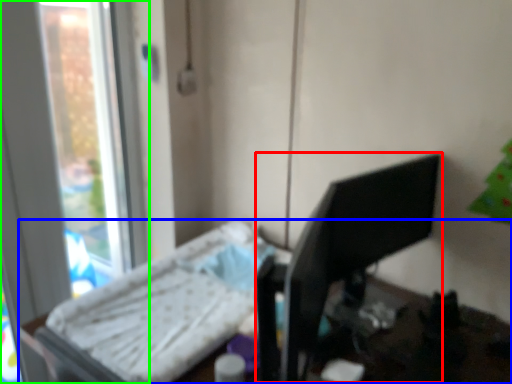
Question: Which is nearer to the desktop computer (highlighted by a red box)? furniture (highlighted by a blue box) or window (highlighted by a green box).

Choices:
 (A) furniture
 (B) window

Answer: (A)